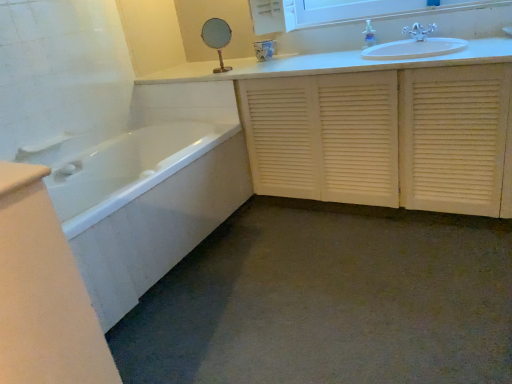
You are a GUI agent. You are given a task and a screenshot of the screen. Output one action in this format:
    pyautogui.click(x=<x>, y=<y>)
    Task: Click on the free region on the left part of silver metallic faucet at upper right
    
    Given the screenshot: What is the action you would take?
    pyautogui.click(x=389, y=42)